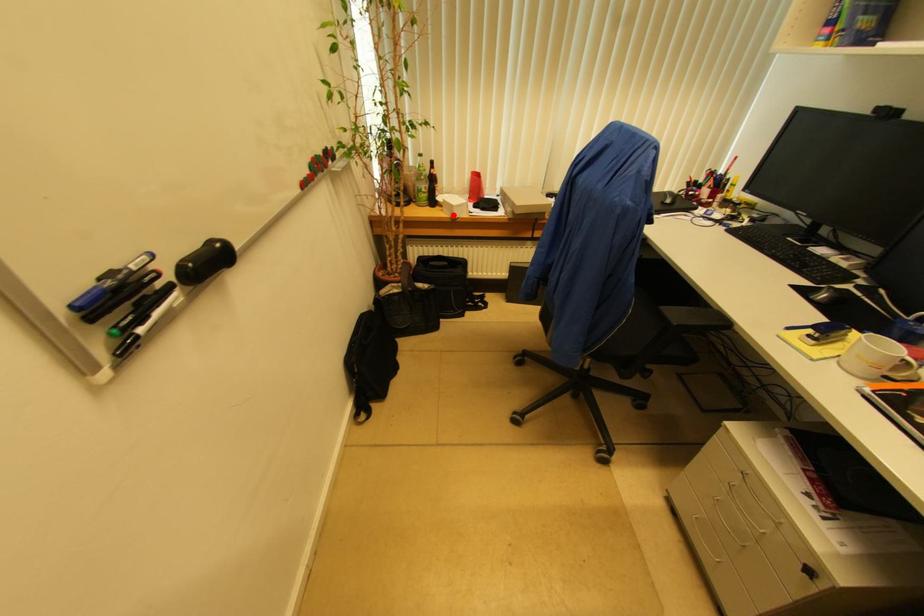
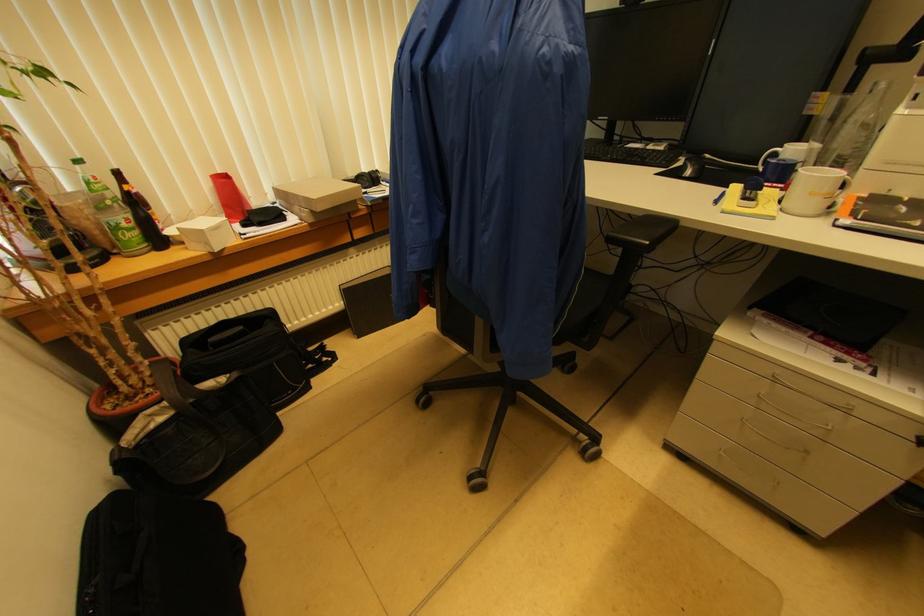
In the second image, find the point that corresponds to the highlighted location in the first image.

(209, 246)